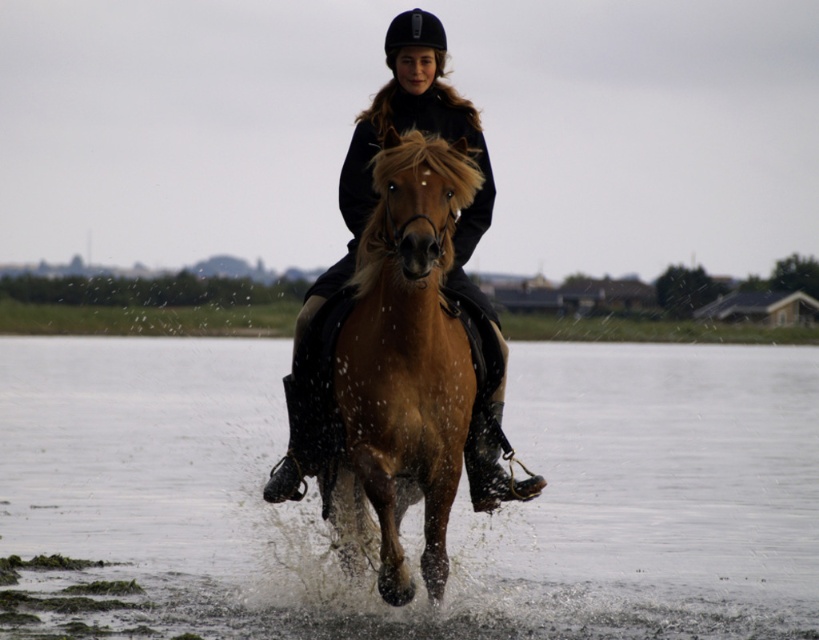
Question: Based on their relative distances, which object is nearer to the shiny black helmet at center?

Choices:
 (A) brown glossy horse at center
 (B) clear water at lower center

Answer: (A)

Question: Can you confirm if clear water at lower center is wider than brown glossy horse at center?

Choices:
 (A) no
 (B) yes

Answer: (B)

Question: Based on their relative distances, which object is nearer to the brown glossy horse at center?

Choices:
 (A) clear water at lower center
 (B) shiny black helmet at center

Answer: (B)

Question: Can you confirm if clear water at lower center is positioned to the right of shiny black helmet at center?

Choices:
 (A) no
 (B) yes

Answer: (B)

Question: Does clear water at lower center appear on the left side of shiny black helmet at center?

Choices:
 (A) yes
 (B) no

Answer: (B)

Question: Among these objects, which one is nearest to the camera?

Choices:
 (A) shiny black helmet at center
 (B) brown glossy horse at center

Answer: (B)